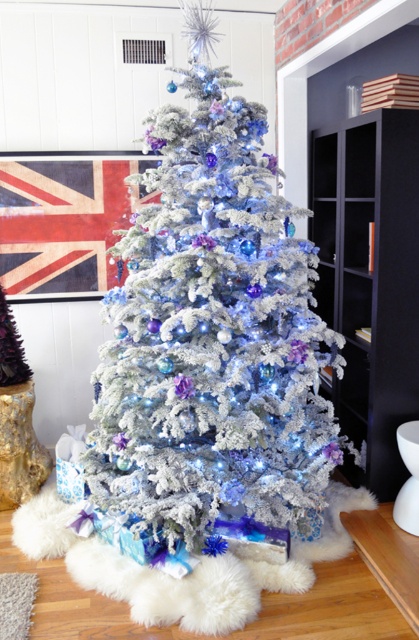
In the scene shown: You are arranging a living room and want to place a new sofa between the frosted white christmas tree at center and the black matte bookshelf at right. Can you fit the sofa between them if the sofa is 1.2 meters wide?

The frosted white christmas tree at center is positioned on the left side of black matte bookshelf at right. Since the distance between them isn not specified, we cannot determine if the sofa will fit. Please provide more information about the space between them.

You are standing in the living room and want to take a photo of the frosted white christmas tree at center without the black matte bookshelf at right appearing in the background. Is the current position possible?

The frosted white christmas tree at center is in front of the black matte bookshelf at right, so taking a photo from this angle would include the bookshelf in the background. To avoid it, move to a position where the tree is between you and the bookshelf or find an angle where the bookshelf is out of frame.

You are planning to move the black matte bookshelf at right closer to the frosted white christmas tree at center. Given their sizes, will the bookshelf fit entirely in front of the tree without overlapping it?

The frosted white christmas tree at center is larger in size than the black matte bookshelf at right, so the bookshelf will fit in front of the tree without overlapping it since it is smaller.